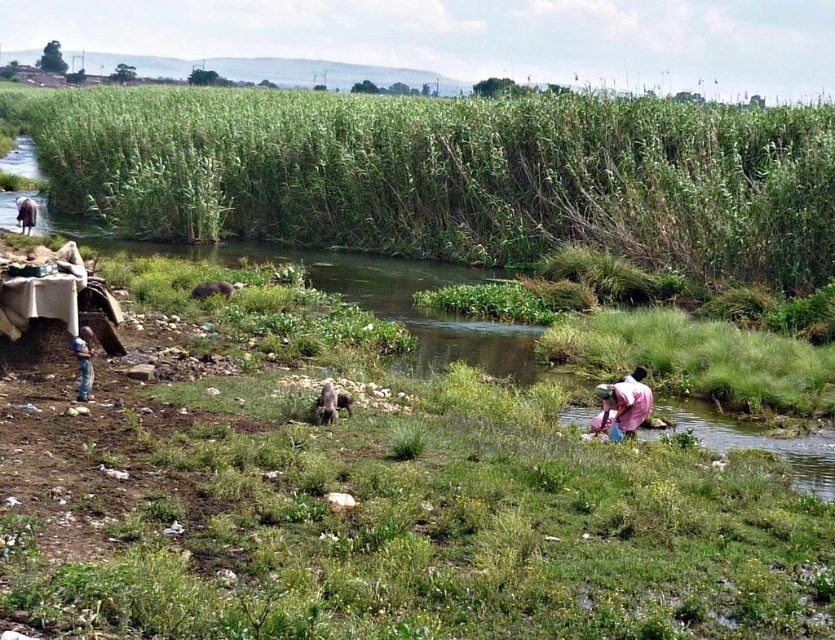
Question: Which point is farther from the camera taking this photo?

Choices:
 (A) (724, 444)
 (B) (100, 182)
 (C) (28, 228)
 (D) (629, 388)

Answer: (B)

Question: Which object appears closest to the camera in this image?

Choices:
 (A) light brown fabric at lower left
 (B) pink fabric at lower right
 (C) blue fabric bag at left

Answer: (C)

Question: Considering the relative positions of green grassy river at center and light brown fabric at lower left in the image provided, where is green grassy river at center located with respect to light brown fabric at lower left?

Choices:
 (A) right
 (B) left

Answer: (B)

Question: Is pink fabric at lower right to the right of blue fabric bag at left from the viewer's perspective?

Choices:
 (A) no
 (B) yes

Answer: (B)

Question: Is the position of green grassy river at center more distant than that of light brown fabric at lower left?

Choices:
 (A) yes
 (B) no

Answer: (B)

Question: Which point is farther to the camera?

Choices:
 (A) (600, 385)
 (B) (282, 109)
 (C) (808, 468)
 (D) (21, 204)

Answer: (B)